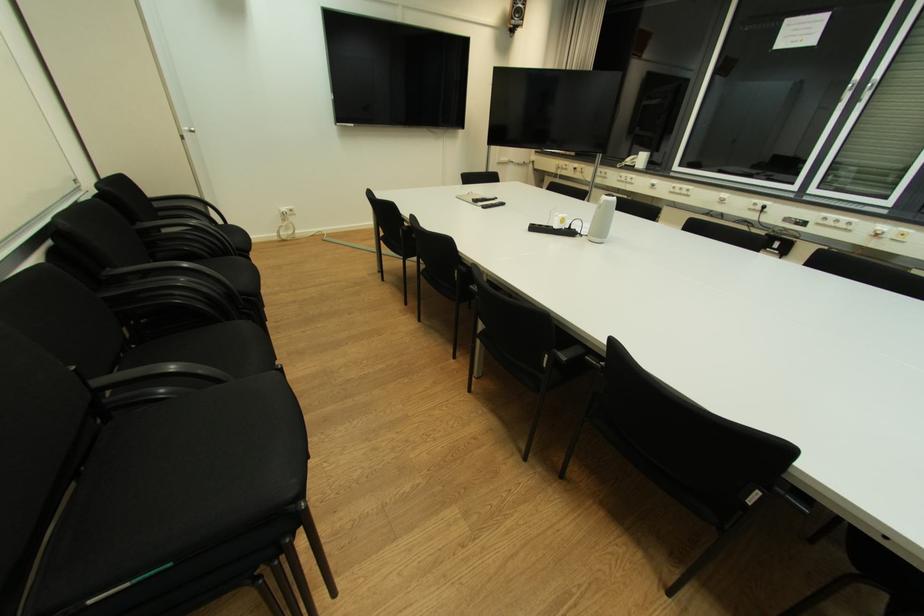
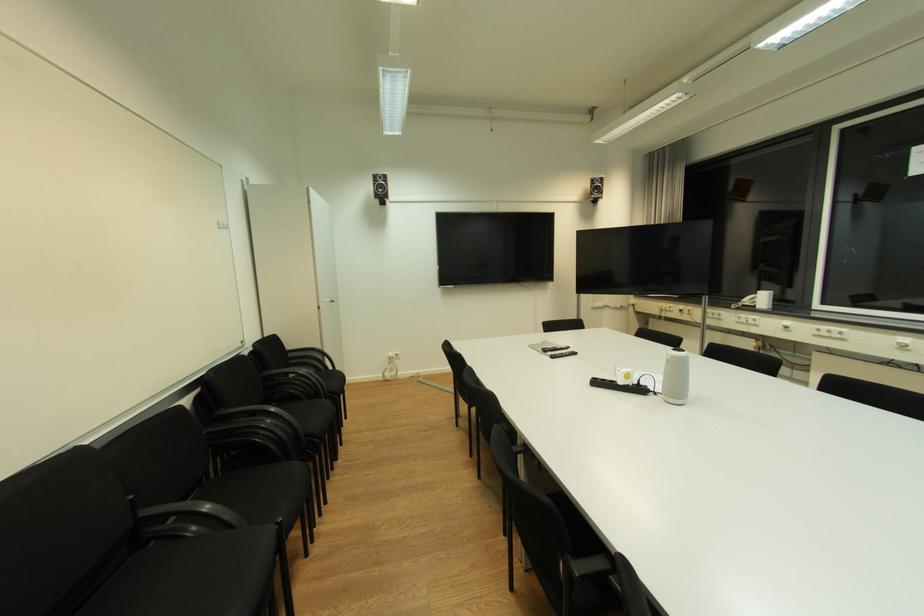
The point at (191, 129) is marked in the first image. Where is the corresponding point in the second image?

(334, 301)